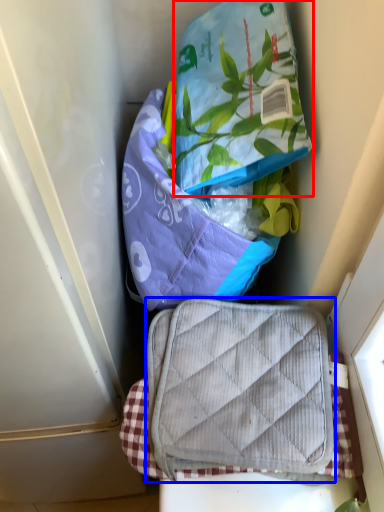
Question: Which object appears farthest to the camera in this image, pouch (highlighted by a red box) or luggage and bags (highlighted by a blue box)?

Choices:
 (A) pouch
 (B) luggage and bags

Answer: (B)